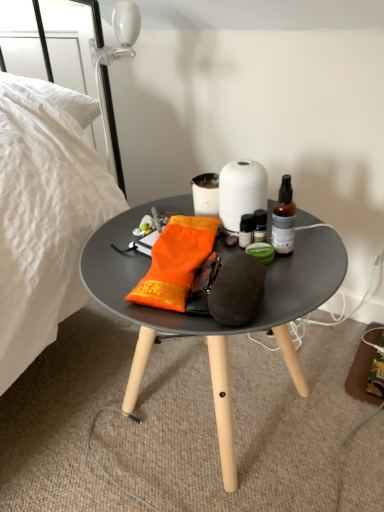
Image resolution: width=384 pixels, height=512 pixels. Find the location of `free space in front of white matte vase at center`. free space in front of white matte vase at center is located at coordinates (268, 274).